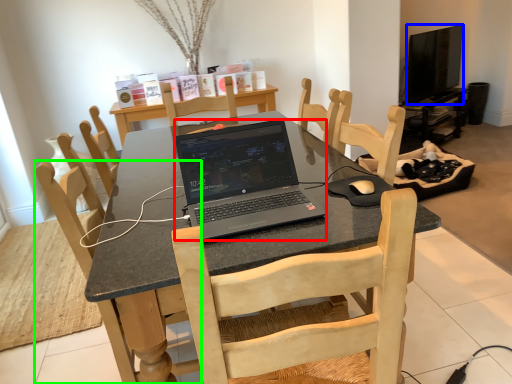
Question: Considering the real-world distances, which object is farthest from laptop (highlighted by a red box)? television (highlighted by a blue box) or chair (highlighted by a green box)?

Choices:
 (A) television
 (B) chair

Answer: (A)